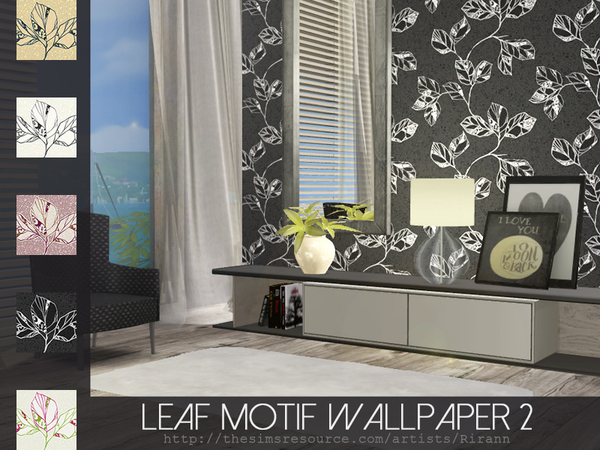
Locate an element on the screen. vase is located at coordinates (323, 242).